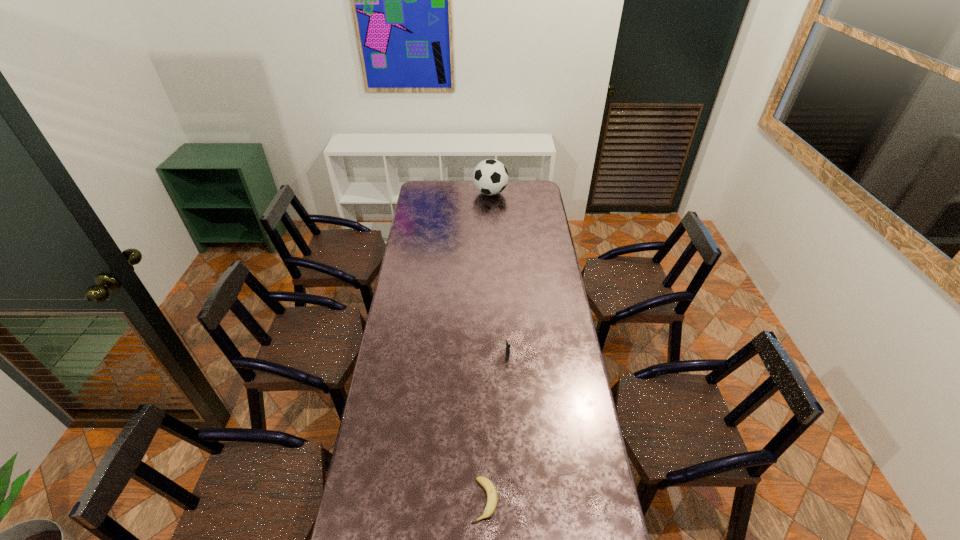
Find the location of a particular element. The width and height of the screenshot is (960, 540). vacant area that lies between the shortest object and the soccer ball is located at coordinates (488, 347).

This screenshot has height=540, width=960. In order to click on free space between the tallest object and the igniter in this screenshot , I will do `click(499, 274)`.

Locate an element on the screen. free space between the soccer ball and the igniter is located at coordinates 499,274.

Select which object appears as the closest to the igniter. Please provide its 2D coordinates. Your answer should be formatted as a tuple, i.e. [(x, y)], where the tuple contains the x and y coordinates of a point satisfying the conditions above.

[(492, 498)]

You are a GUI agent. You are given a task and a screenshot of the screen. Output one action in this format:
    pyautogui.click(x=<x>, y=<y>)
    Task: Click on the object that is the second closest to the tallest object
    
    Given the screenshot: What is the action you would take?
    pyautogui.click(x=492, y=498)

Identify the location of free space that satisfies the following two spatial constraints: 1. on the back side of the shortest object; 2. on the left side of the igniter. This screenshot has height=540, width=960. (484, 355).

Where is `vacant space that satisfies the following two spatial constraints: 1. on the front side of the second nearest object; 2. on the right side of the soccer ball`? Image resolution: width=960 pixels, height=540 pixels. vacant space that satisfies the following two spatial constraints: 1. on the front side of the second nearest object; 2. on the right side of the soccer ball is located at coordinates (495, 355).

Where is `vacant space that satisfies the following two spatial constraints: 1. on the front side of the farthest object; 2. on the right side of the igniter`? This screenshot has width=960, height=540. vacant space that satisfies the following two spatial constraints: 1. on the front side of the farthest object; 2. on the right side of the igniter is located at coordinates (495, 355).

Find the location of a particular element. This screenshot has width=960, height=540. vacant space that satisfies the following two spatial constraints: 1. on the back side of the nearest object; 2. on the right side of the second tallest object is located at coordinates (484, 355).